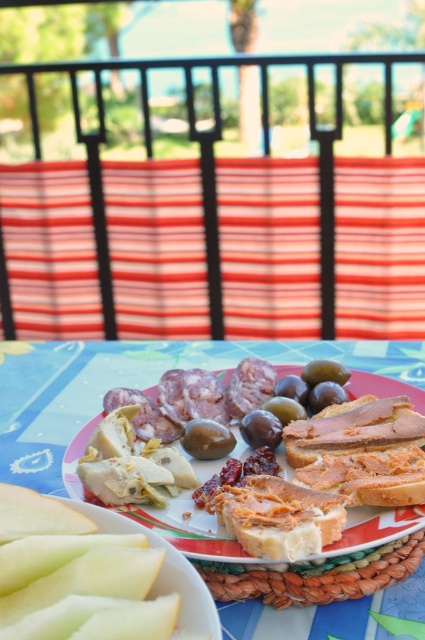
Between green matte apple at lower left and matte white plate at center, which one appears on the left side from the viewer's perspective?

green matte apple at lower left

Which is more to the right, green matte apple at lower left or matte white plate at center?

matte white plate at center is more to the right.

Is point (20, 625) in front of point (65, 449)?

Yes, it is in front of point (65, 449).

Find the location of a particular element. The width and height of the screenshot is (425, 640). green matte apple at lower left is located at coordinates (93, 576).

Is matte white plate at center wider than green glossy olive at center?

Correct, the width of matte white plate at center exceeds that of green glossy olive at center.

Is matte white plate at center further to the viewer compared to green glossy olive at center?

No, matte white plate at center is closer to the viewer.

Who is more forward, (81, 433) or (223, 442)?

Point (223, 442) is more forward.

I want to click on matte white plate at center, so click(x=376, y=529).

Does green glossy olive at center appear on the right side of shiny dark green olive at center?

In fact, green glossy olive at center is to the left of shiny dark green olive at center.

Is point (204, 419) positioned behind point (260, 419)?

Yes, point (204, 419) is behind point (260, 419).

Describe the element at coordinates (206, 440) in the screenshot. Image resolution: width=425 pixels, height=640 pixels. I see `green glossy olive at center` at that location.

The width and height of the screenshot is (425, 640). I want to click on green glossy olive at center, so click(206, 440).